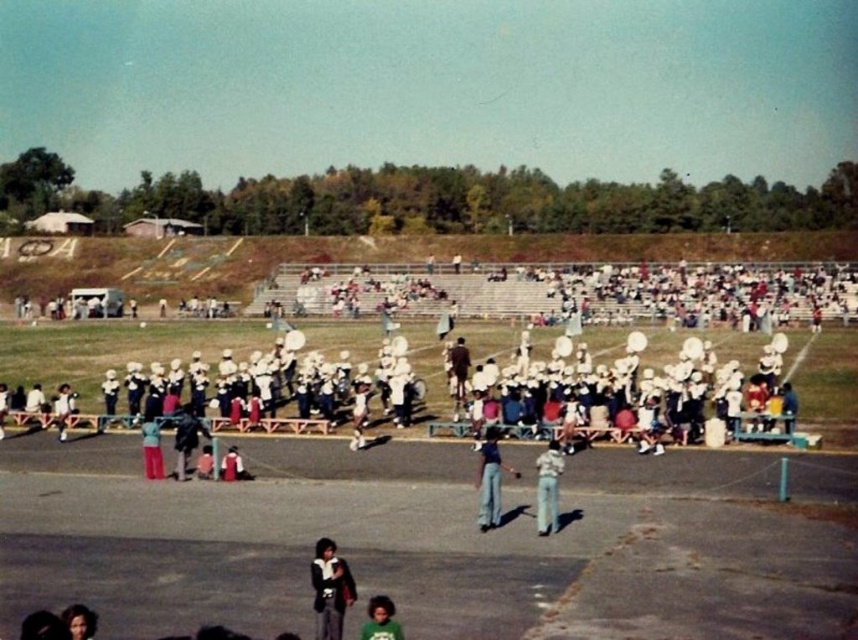
Does dark brown leather jacket at lower center appear over blue jeans at center?

No.

Is point (325, 616) closer to camera compared to point (493, 454)?

Yes, it is.

Where is `dark brown leather jacket at lower center`? dark brown leather jacket at lower center is located at coordinates (330, 589).

Which is above, dark brown leather jacket at lower center or green matte shirt at lower center?

dark brown leather jacket at lower center

Can you confirm if dark brown leather jacket at lower center is positioned to the left of green matte shirt at lower center?

Yes, dark brown leather jacket at lower center is to the left of green matte shirt at lower center.

Is point (329, 636) positioned after point (379, 634)?

Yes, it is behind point (379, 634).

Locate an element on the screen. Image resolution: width=858 pixels, height=640 pixels. dark brown leather jacket at lower center is located at coordinates (330, 589).

Is the position of blue jeans at center more distant than that of matte red pants at center?

That is False.

Which is more to the right, blue jeans at center or matte red pants at center?

From the viewer's perspective, blue jeans at center appears more on the right side.

Which is in front, point (482, 504) or point (156, 468)?

Point (482, 504) is in front.

The width and height of the screenshot is (858, 640). I want to click on blue jeans at center, so click(490, 481).